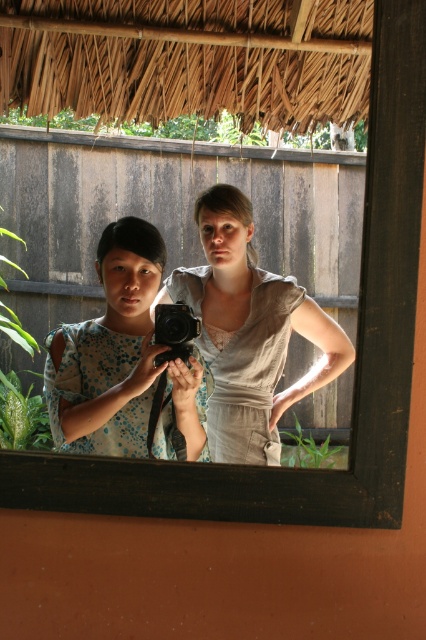
Question: Can you confirm if light beige fabric dress at center is positioned below blue dotted fabric dress at left?

Choices:
 (A) no
 (B) yes

Answer: (A)

Question: Does blue dotted fabric dress at left appear on the left side of black plastic camera at center?

Choices:
 (A) yes
 (B) no

Answer: (A)

Question: Among these objects, which one is nearest to the camera?

Choices:
 (A) black plastic camera at center
 (B) light beige fabric dress at center
 (C) blue dotted fabric dress at left

Answer: (C)

Question: Among these points, which one is farthest from the camera?

Choices:
 (A) (160, 364)
 (B) (80, 435)

Answer: (B)

Question: Does light beige fabric dress at center appear under blue dotted fabric dress at left?

Choices:
 (A) no
 (B) yes

Answer: (A)

Question: Which of these objects is positioned farthest from the light beige fabric dress at center?

Choices:
 (A) blue dotted fabric dress at left
 (B) black plastic camera at center

Answer: (B)